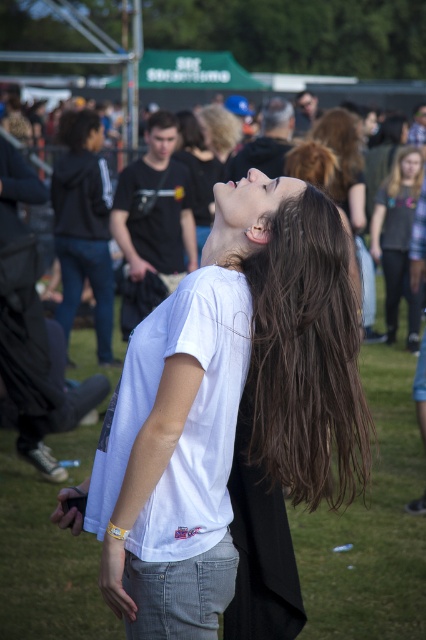
Question: Observing the image, what is the correct spatial positioning of brown silky hair at center in reference to matte black t-shirt at upper center?

Choices:
 (A) right
 (B) left

Answer: (A)

Question: Which of these objects is positioned farthest from the brown straight hair at upper right?

Choices:
 (A) smooth skin face at upper center
 (B) matte black t-shirt at upper center
 (C) matte black jacket at right

Answer: (B)

Question: Is white matte t-shirt at center further to the viewer compared to smooth skin face at upper center?

Choices:
 (A) no
 (B) yes

Answer: (A)

Question: Is matte black jacket at right positioned at the back of matte black t-shirt at upper center?

Choices:
 (A) yes
 (B) no

Answer: (A)

Question: Among these objects, which one is nearest to the camera?

Choices:
 (A) matte black jacket at right
 (B) smooth skin face at upper center
 (C) white matte t-shirt at center
 (D) brown silky hair at center

Answer: (C)

Question: Which of the following is the farthest from the observer?

Choices:
 (A) brown silky hair at center
 (B) matte black t-shirt at upper center
 (C) brown straight hair at upper right

Answer: (C)